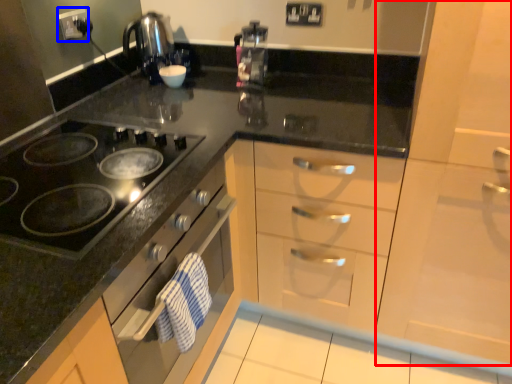
Question: Which of the following is the farthest to the observer, cabinetry (highlighted by a red box) or electric outlet (highlighted by a blue box)?

Choices:
 (A) cabinetry
 (B) electric outlet

Answer: (B)